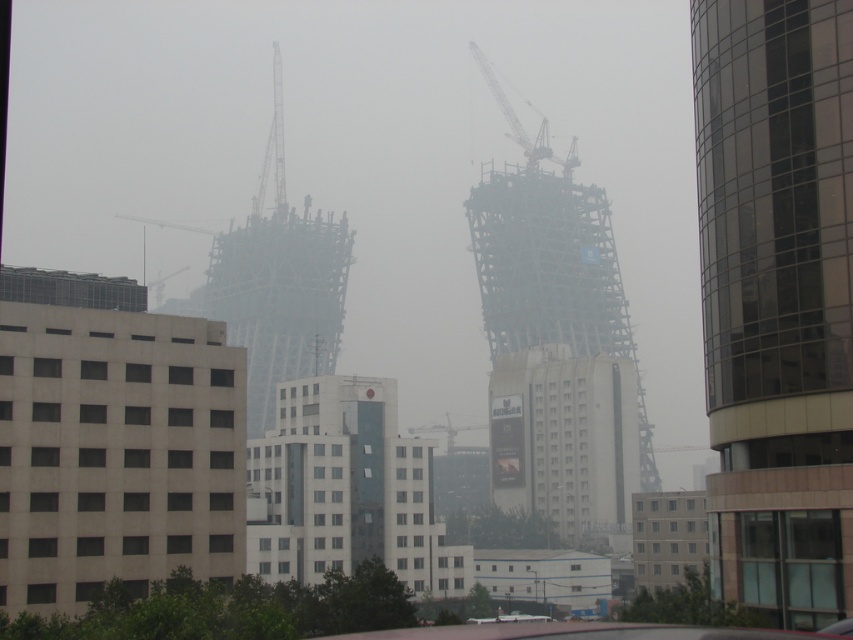
You are a delivery drone that needs to fly from the beige concrete building at left to the white glass building at center. The minimum safe distance for your drone is 40 meters. Can you safely make this delivery?

The beige concrete building at left is 43.01 meters from the white glass building at center, so yes, the drone can safely make the delivery as the distance is above the minimum safe requirement of 40 meters.